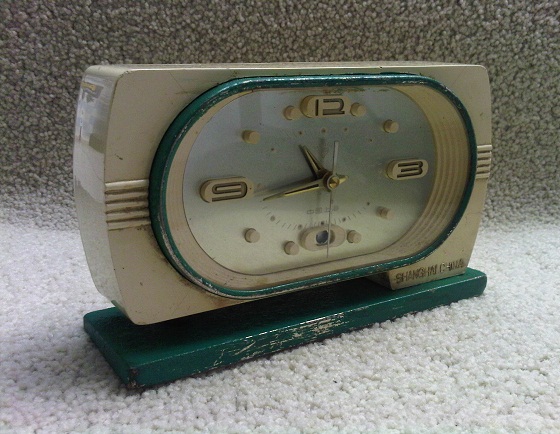
Image resolution: width=560 pixels, height=434 pixels. I want to click on clock hand, so click(315, 162), click(305, 188), click(331, 204).